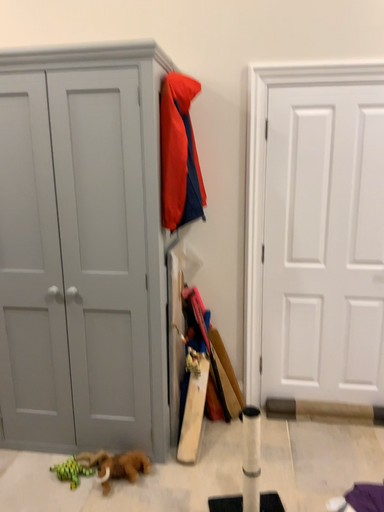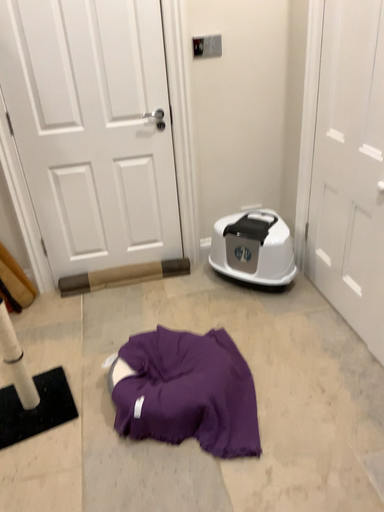
Question: Which way did the camera rotate in the video?

Choices:
 (A) rotated left
 (B) rotated right

Answer: (B)